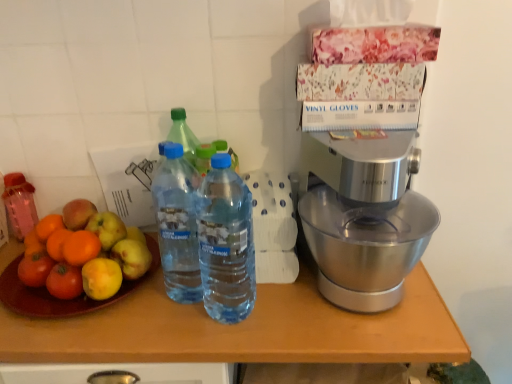
This screenshot has height=384, width=512. Describe the element at coordinates (229, 335) in the screenshot. I see `wooden table at center` at that location.

At what (x,y) coordinates should I click in order to perform the action: click on shiny green apple at left. Please return your answer as a coordinate pair (x, y). This screenshot has height=384, width=512. Looking at the image, I should click on (84, 255).

Is blue plastic bottle at center, placed as the second bottle when sorted from right to left, next to pink translucent bottle at left, placed as the 1th bottle when sorted from left to right, and touching it?

No, blue plastic bottle at center, placed as the second bottle when sorted from right to left, is not next to pink translucent bottle at left, placed as the 1th bottle when sorted from left to right.

Is blue plastic bottle at center, placed as the second bottle when sorted from right to left, not within pink translucent bottle at left, placed as the 1th bottle when sorted from left to right?

Absolutely, blue plastic bottle at center, placed as the second bottle when sorted from right to left, is external to pink translucent bottle at left, placed as the 1th bottle when sorted from left to right.

Is blue plastic bottle at center, positioned as the second bottle in left-to-right order, wider than pink translucent bottle at left, placed as the 1th bottle when sorted from left to right?

Yes.

Considering the points (180, 199) and (9, 211), which point is in front, point (180, 199) or point (9, 211)?

The point (180, 199) is closer to the camera.

Is blue plastic bottle at center, placed as the second bottle when sorted from front to back, at the right side of silver metallic mixer at right?

Incorrect, blue plastic bottle at center, placed as the second bottle when sorted from front to back, is not on the right side of silver metallic mixer at right.

Which point is more forward, (183, 189) or (321, 282)?

The point (183, 189) is closer.

Are blue plastic bottle at center, placed as the second bottle when sorted from front to back, and silver metallic mixer at right beside each other?

blue plastic bottle at center, placed as the second bottle when sorted from front to back, is not next to silver metallic mixer at right, and they're not touching.

From the image's perspective, relative to silver metallic mixer at right, is wooden table at center above or below?

Clearly, from the image's perspective, wooden table at center is below silver metallic mixer at right.

This screenshot has height=384, width=512. What are the coordinates of `table below the silver metallic mixer at right (from a real-world perspective)` in the screenshot? It's located at (229, 335).

From a real-world perspective, is wooden table at center positioned over silver metallic mixer at right based on gravity?

Actually, wooden table at center is physically below silver metallic mixer at right in the real world.

Between point (237, 314) and point (311, 246), which one is positioned behind?

Point (311, 246)

Considering the positions of objects transparent plastic bottle at center, placed as the first bottle when sorted from front to back, and silver metallic mixer at right in the image provided, who is more to the left, transparent plastic bottle at center, placed as the first bottle when sorted from front to back, or silver metallic mixer at right?

From the viewer's perspective, transparent plastic bottle at center, placed as the first bottle when sorted from front to back, appears more on the left side.

Would you say transparent plastic bottle at center, which is counted as the 3th bottle, starting from the left, is outside silver metallic mixer at right?

Yes, transparent plastic bottle at center, which is counted as the 3th bottle, starting from the left, is located beyond the bounds of silver metallic mixer at right.

Does transparent plastic bottle at center, placed as the first bottle when sorted from front to back, touch silver metallic mixer at right?

There is a gap between transparent plastic bottle at center, placed as the first bottle when sorted from front to back, and silver metallic mixer at right.

Is pink translucent bottle at left, which is the 3th bottle in front-to-back order, far away from transparent plastic bottle at center, acting as the 3th bottle starting from the back?

No, there isn't a large distance between pink translucent bottle at left, which is the 3th bottle in front-to-back order, and transparent plastic bottle at center, acting as the 3th bottle starting from the back.

From the image's perspective, which one is positioned higher, pink translucent bottle at left, which is counted as the first bottle, starting from the back, or transparent plastic bottle at center, acting as the 3th bottle starting from the back?

From the image's view, pink translucent bottle at left, which is counted as the first bottle, starting from the back, is above.

Is pink translucent bottle at left, arranged as the third bottle when viewed from the right, to the right of transparent plastic bottle at center, placed as the first bottle when sorted from front to back, from the viewer's perspective?

No.

Based on their sizes in the image, would you say silver metallic mixer at right is bigger or smaller than pink translucent bottle at left, placed as the 1th bottle when sorted from left to right?

silver metallic mixer at right is bigger than pink translucent bottle at left, placed as the 1th bottle when sorted from left to right.

Does silver metallic mixer at right have a greater height compared to pink translucent bottle at left, arranged as the third bottle when viewed from the right?

Yes.

Starting from the silver metallic mixer at right, which bottle is the 2nd one behind? Please provide its 2D coordinates.

[(19, 204)]

Could you measure the distance between pink translucent bottle at left, which is counted as the first bottle, starting from the back, and silver metallic mixer at right?

pink translucent bottle at left, which is counted as the first bottle, starting from the back, is 30.39 inches from silver metallic mixer at right.

Identify the location of mixer above the pink translucent bottle at left, placed as the 1th bottle when sorted from left to right (from a real-world perspective). (362, 217).

Which is closer to the camera, (27, 229) or (436, 213)?

Clearly, point (27, 229) is more distant from the camera than point (436, 213).

Considering the relative positions of pink translucent bottle at left, which is the 3th bottle in front-to-back order, and silver metallic mixer at right in the image provided, is pink translucent bottle at left, which is the 3th bottle in front-to-back order, to the left of silver metallic mixer at right from the viewer's perspective?

Indeed, pink translucent bottle at left, which is the 3th bottle in front-to-back order, is positioned on the left side of silver metallic mixer at right.

From the pink translucent bottle at left, placed as the 1th bottle when sorted from left to right, count 1st bottle to the right and point to it. Please provide its 2D coordinates.

[(177, 224)]

I want to click on the 1st bottle behind the silver metallic mixer at right, counting from the anchor's position, so click(177, 224).

When comparing their distances from pink translucent bottle at left, placed as the 1th bottle when sorted from left to right, does transparent plastic bottle at center, acting as the 3th bottle starting from the back, or shiny green apple at left seem further?

transparent plastic bottle at center, acting as the 3th bottle starting from the back, is further to pink translucent bottle at left, placed as the 1th bottle when sorted from left to right.

In the scene shown: Based on their spatial positions, is transparent plastic bottle at center, which is counted as the 3th bottle, starting from the left, or blue plastic bottle at center, placed as the second bottle when sorted from right to left, closer to pink translucent bottle at left, which is the 3th bottle in front-to-back order?

blue plastic bottle at center, placed as the second bottle when sorted from right to left, is closer to pink translucent bottle at left, which is the 3th bottle in front-to-back order.

When comparing their distances from silver metallic mixer at right, does pink translucent bottle at left, which is counted as the first bottle, starting from the back, or shiny green apple at left seem further?

pink translucent bottle at left, which is counted as the first bottle, starting from the back, lies further to silver metallic mixer at right than the other object.

Looking at this image, from the image, which object appears to be farther from silver metallic mixer at right, wooden table at center or pink translucent bottle at left, which is the 3th bottle in front-to-back order?

pink translucent bottle at left, which is the 3th bottle in front-to-back order, is positioned further to the anchor silver metallic mixer at right.

Considering their positions, is wooden table at center positioned closer to silver metallic mixer at right than blue plastic bottle at center, placed as the second bottle when sorted from right to left?

wooden table at center.

When comparing their distances from shiny green apple at left, does transparent plastic bottle at center, the first bottle positioned from the right, or silver metallic mixer at right seem further?

Among the two, silver metallic mixer at right is located further to shiny green apple at left.

Looking at the image, which one is located closer to pink translucent bottle at left, which is the 3th bottle in front-to-back order, wooden table at center or transparent plastic bottle at center, acting as the 3th bottle starting from the back?

wooden table at center.

Estimate the real-world distances between objects in this image. Which object is closer to silver metallic mixer at right, blue plastic bottle at center, placed as the second bottle when sorted from front to back, or transparent plastic bottle at center, placed as the first bottle when sorted from front to back?

transparent plastic bottle at center, placed as the first bottle when sorted from front to back, lies closer to silver metallic mixer at right than the other object.

The width and height of the screenshot is (512, 384). Identify the location of apple between blue plastic bottle at center, positioned as the second bottle in left-to-right order, and wooden table at center, in the vertical direction. (84, 255).

Find the location of a particular element. The width and height of the screenshot is (512, 384). apple between pink translucent bottle at left, which is the 3th bottle in front-to-back order, and wooden table at center vertically is located at coordinates (84, 255).

The width and height of the screenshot is (512, 384). What are the coordinates of `table between shiny green apple at left and silver metallic mixer at right in the horizontal direction` in the screenshot? It's located at (229, 335).

Where is `bottle between blue plastic bottle at center, placed as the second bottle when sorted from right to left, and wooden table at center from top to bottom`? Image resolution: width=512 pixels, height=384 pixels. bottle between blue plastic bottle at center, placed as the second bottle when sorted from right to left, and wooden table at center from top to bottom is located at coordinates (226, 243).